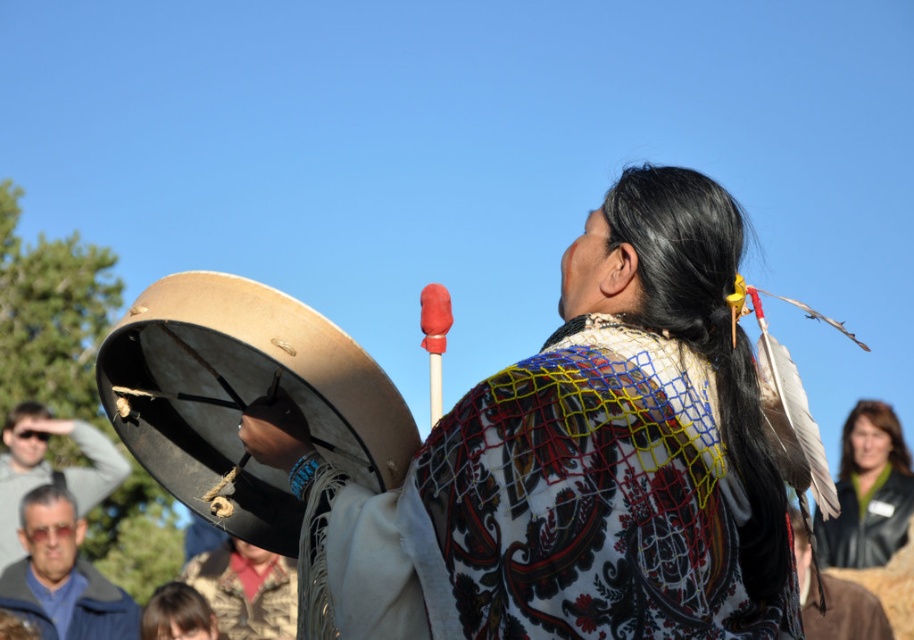
Find the location of a particular element. This screenshot has width=914, height=640. blue denim jacket at lower left is located at coordinates (62, 576).

Is the position of blue denim jacket at lower left less distant than that of smooth brown hair at lower left?

No, blue denim jacket at lower left is behind smooth brown hair at lower left.

Who is more forward, (84, 525) or (208, 608)?

Positioned in front is point (208, 608).

The image size is (914, 640). Identify the location of blue denim jacket at lower left. (62, 576).

Can you confirm if textured fabric shawl at center is shorter than matte gray sunglasses at lower left?

Incorrect, textured fabric shawl at center's height does not fall short of matte gray sunglasses at lower left's.

Is point (515, 500) positioned in front of point (68, 481)?

Yes, it is.

The image size is (914, 640). I want to click on textured fabric shawl at center, so click(576, 461).

This screenshot has width=914, height=640. In order to click on textured fabric shawl at center in this screenshot , I will do tap(576, 461).

Can you confirm if matte brown drum at center is taller than leather jacket at center?

In fact, matte brown drum at center may be shorter than leather jacket at center.

Is matte brown drum at center to the left of leather jacket at center from the viewer's perspective?

Indeed, matte brown drum at center is positioned on the left side of leather jacket at center.

Image resolution: width=914 pixels, height=640 pixels. I want to click on matte brown drum at center, so click(243, 397).